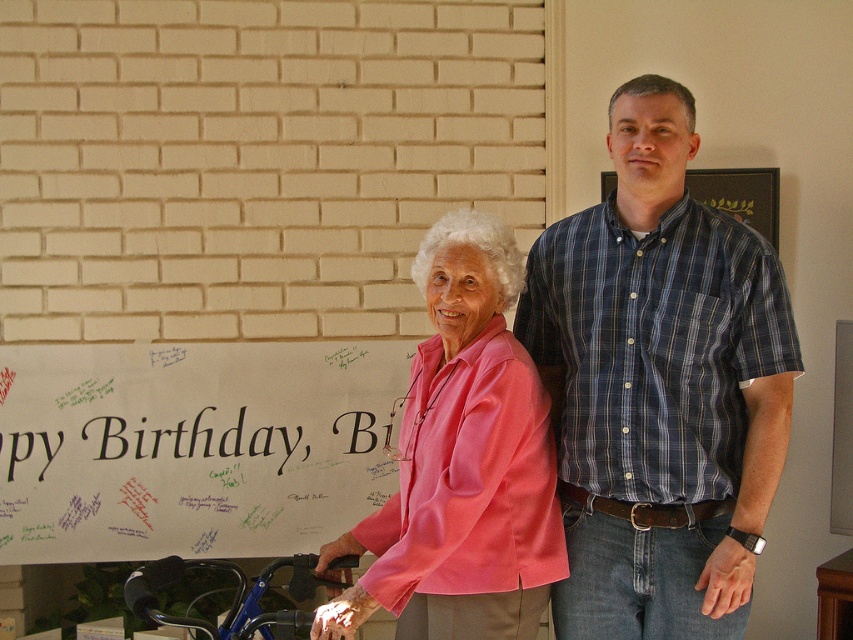
Is blue plaid shirt at center in front of matte wood frame at upper center?

Yes, blue plaid shirt at center is closer to the viewer.

Does point (749, 465) come farther from viewer compared to point (769, 237)?

That is False.

This screenshot has height=640, width=853. What do you see at coordinates (659, 387) in the screenshot?
I see `blue plaid shirt at center` at bounding box center [659, 387].

This screenshot has width=853, height=640. I want to click on blue plaid shirt at center, so click(659, 387).

Describe the element at coordinates (462, 464) in the screenshot. I see `pink satin blouse at center` at that location.

Is pink satin blouse at center wider than matte wood frame at upper center?

Indeed, pink satin blouse at center has a greater width compared to matte wood frame at upper center.

This screenshot has width=853, height=640. What do you see at coordinates (462, 464) in the screenshot?
I see `pink satin blouse at center` at bounding box center [462, 464].

Identify the location of pink satin blouse at center. This screenshot has width=853, height=640. (462, 464).

Which is behind, point (575, 465) or point (463, 461)?

The point (575, 465) is more distant.

Looking at this image, who is more forward, (x=660, y=93) or (x=445, y=468)?

Point (x=445, y=468) is more forward.

Does point (674, 397) lie behind point (428, 460)?

Yes, it is behind point (428, 460).

Locate an element on the screen. This screenshot has width=853, height=640. blue plaid shirt at center is located at coordinates (659, 387).